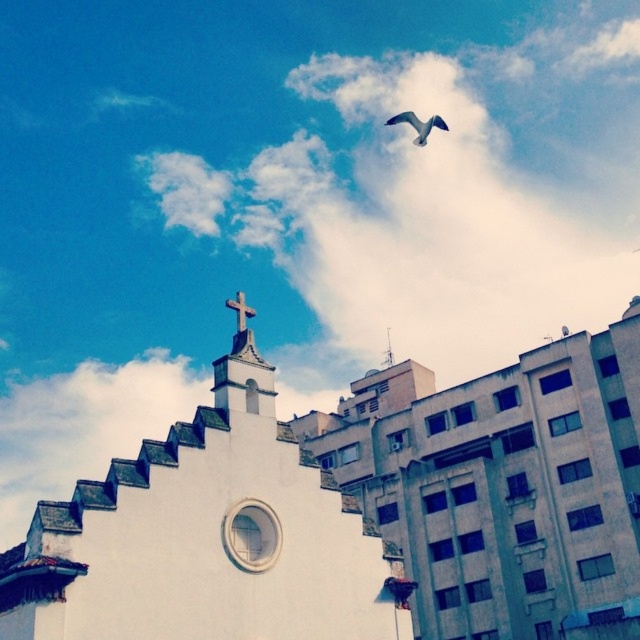
How far apart are white fluffy cloud at upper center and white wooden cross at upper center?

white fluffy cloud at upper center and white wooden cross at upper center are 66.83 meters apart.

Is white fluffy cloud at upper center below white wooden cross at upper center?

Actually, white fluffy cloud at upper center is above white wooden cross at upper center.

Based on the photo, who is more distant from viewer, (x=632, y=234) or (x=240, y=317)?

Positioned behind is point (x=632, y=234).

In order to click on white fluffy cloud at upper center in this screenshot , I will do `click(442, 196)`.

Can you confirm if gray feathered bird at upper center is bigger than white wooden cross at upper center?

Yes, gray feathered bird at upper center is bigger than white wooden cross at upper center.

Who is taller, gray feathered bird at upper center or white wooden cross at upper center?

gray feathered bird at upper center

Identify the location of gray feathered bird at upper center. This screenshot has height=640, width=640. (419, 124).

Find the location of `gray feathered bird at upper center`. gray feathered bird at upper center is located at coordinates (419, 124).

Can you confirm if white matte church at upper center is taller than white fluffy cloud at upper center?

Incorrect, white matte church at upper center's height is not larger of white fluffy cloud at upper center's.

Is point (365, 516) more distant than point (417, 51)?

No, (365, 516) is in front of (417, 51).

Which is in front, point (100, 637) or point (637, 4)?

Positioned in front is point (100, 637).

Locate an element on the screen. white matte church at upper center is located at coordinates (358, 512).